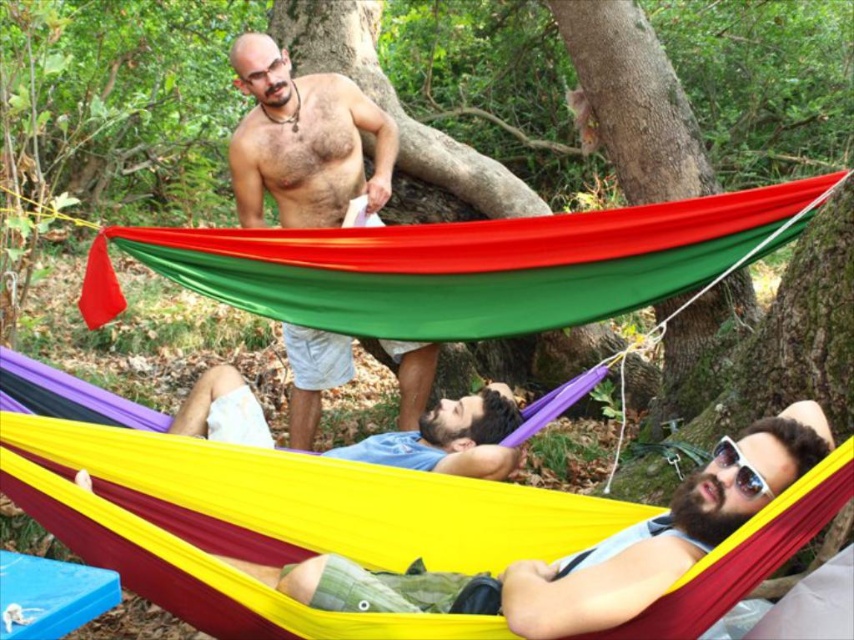
Based on the photo, is yellow/red fabric hammock at lower center above shiny silver necklace at upper center?

No.

Identify the location of yellow/red fabric hammock at lower center. The height and width of the screenshot is (640, 854). (262, 513).

Does blue cotton shirt at lower center have a smaller size compared to sunglasses at center?

No, blue cotton shirt at lower center is not smaller than sunglasses at center.

In the scene shown: Is blue cotton shirt at lower center to the right of sunglasses at center from the viewer's perspective?

No, blue cotton shirt at lower center is not to the right of sunglasses at center.

The width and height of the screenshot is (854, 640). I want to click on blue cotton shirt at lower center, so click(449, 438).

Is shiny silver necklace at upper center below sunglasses at center?

No.

Which is more to the left, shiny silver necklace at upper center or sunglasses at center?

Positioned to the left is shiny silver necklace at upper center.

Is point (382, 180) less distant than point (738, 456)?

No, it is not.

Where is `shiny silver necklace at upper center`? The height and width of the screenshot is (640, 854). shiny silver necklace at upper center is located at coordinates (303, 141).